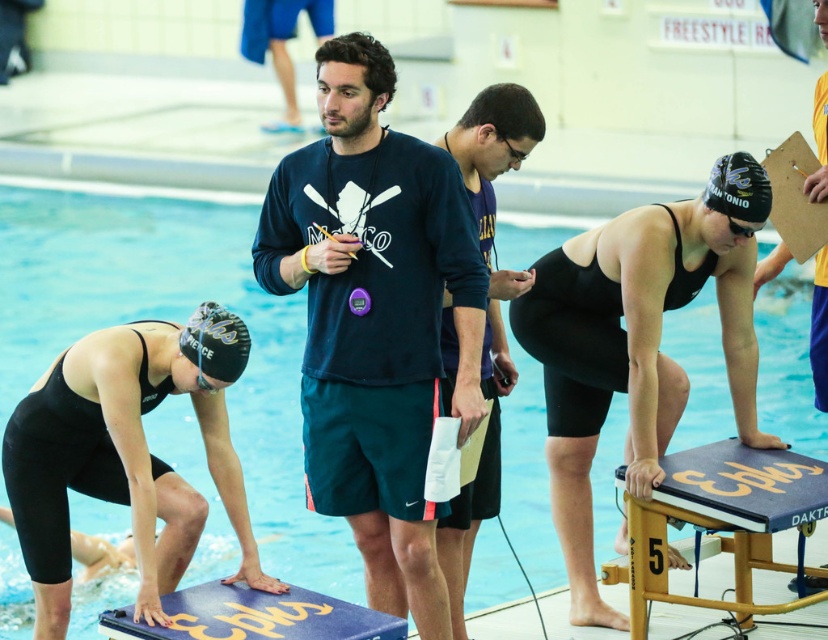
Question: Among these objects, which one is farthest from the camera?

Choices:
 (A) navy blue fabric shirt at center
 (B) black matte diving board at center
 (C) black matte goggles at upper right

Answer: (C)

Question: Which object is closer to the camera taking this photo?

Choices:
 (A) navy blue sweatshirt at center
 (B) blue foam diving board at lower center
 (C) black matte swimsuit at lower left

Answer: (B)

Question: Which of the following is the closest to the observer?

Choices:
 (A) (480, 252)
 (B) (734, 224)
 (C) (809, 348)
 (D) (809, 396)

Answer: (B)

Question: Is blue foam diving board at lower center to the right of yellow jersey at right from the viewer's perspective?

Choices:
 (A) no
 (B) yes

Answer: (A)

Question: Does black matte swimsuit at lower left have a lesser width compared to yellow jersey at right?

Choices:
 (A) yes
 (B) no

Answer: (B)

Question: Observing the image, what is the correct spatial positioning of navy blue fabric shirt at center in reference to yellow jersey at right?

Choices:
 (A) left
 (B) right

Answer: (A)